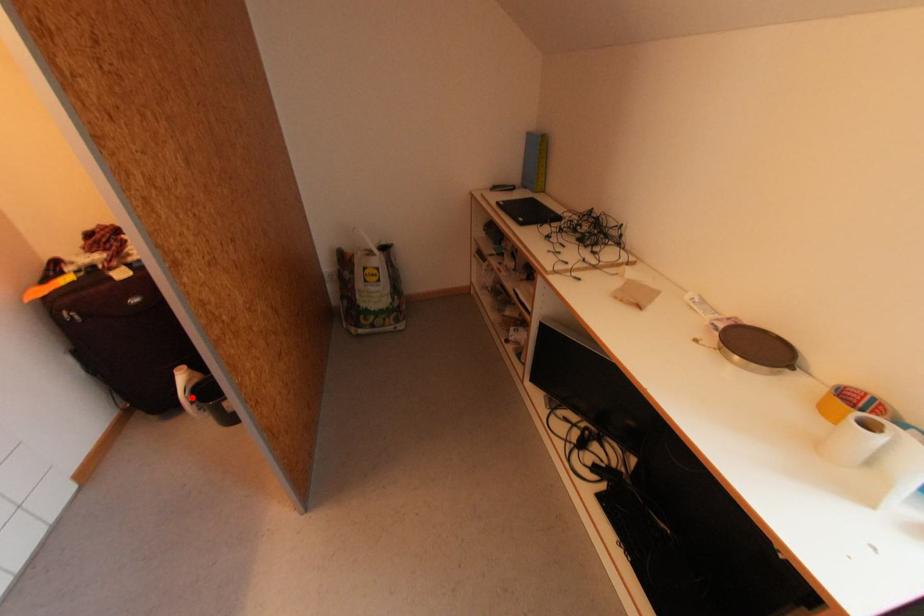
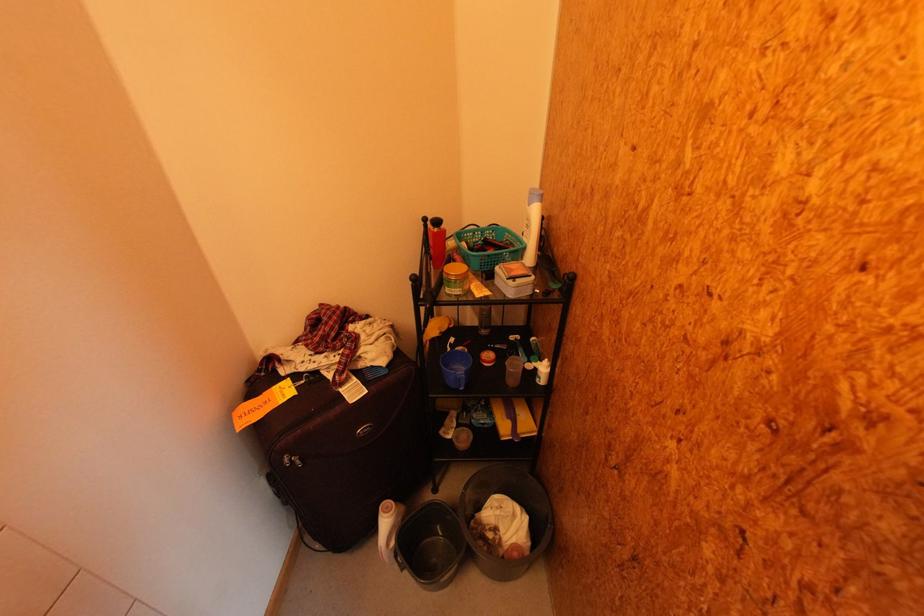
Question: I am providing you with two images of the same scene from different viewpoints. Image1 has a red point marked. In image2, the corresponding 3D location appears at what relative position? Reply with the corresponding letter.

Choices:
 (A) Closer
 (B) Farther

Answer: (B)